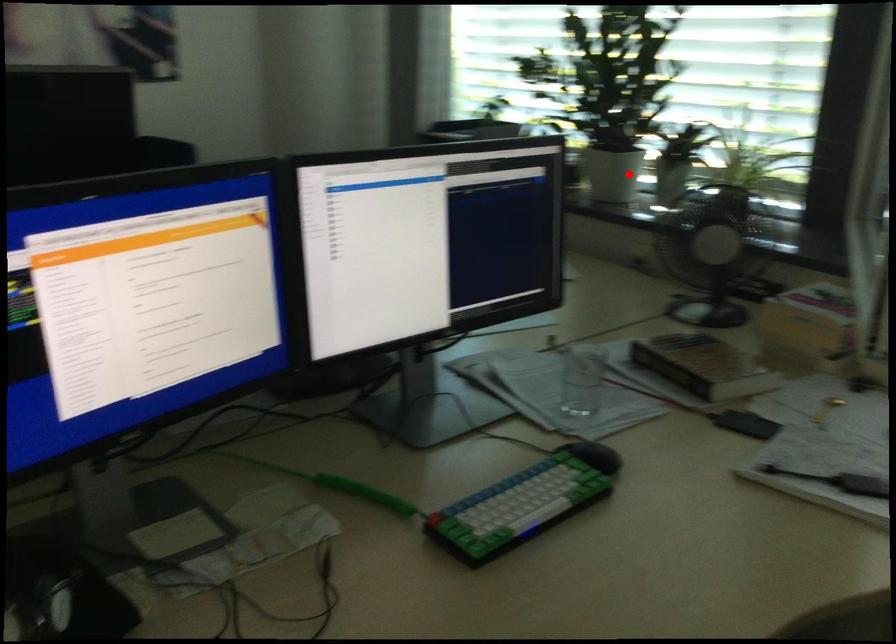
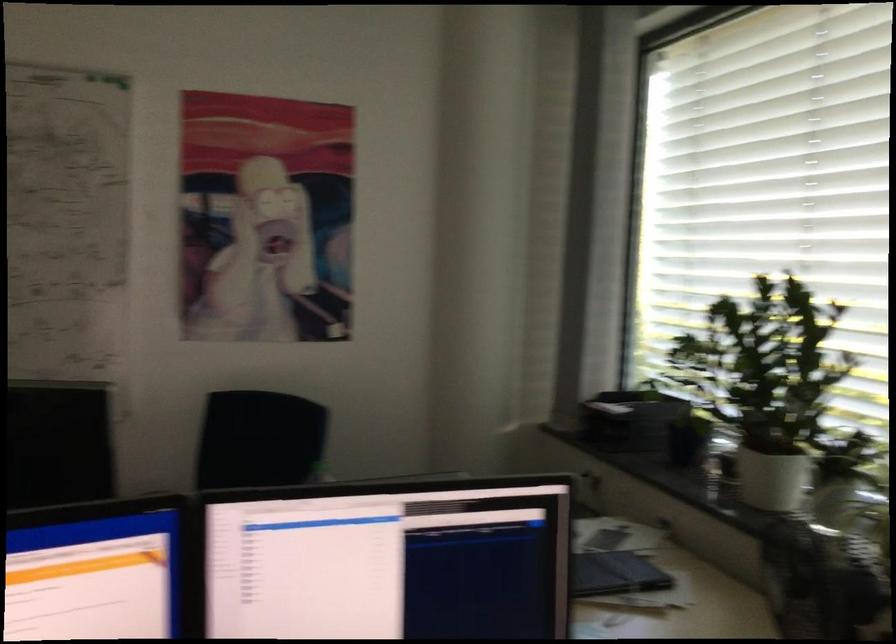
The point at the highlighted location is marked in the first image. Where is the corresponding point in the second image?

(770, 478)